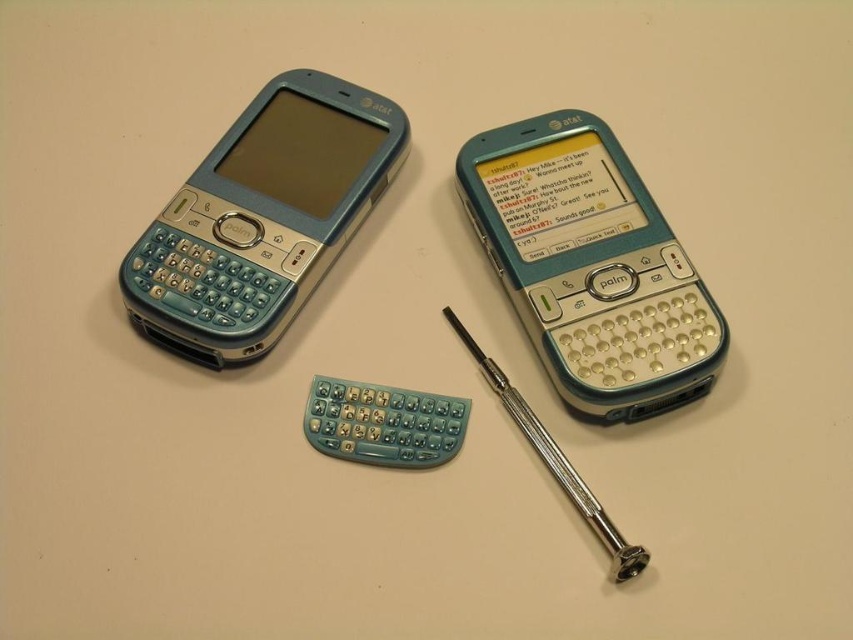
You have a small teal plastic smartphone at center and a teal plastic keyboard at left. You want to place both on a shelf that can only accommodate items up to 10 cm in width. Given their widths, which item will fit better on the shelf?

The teal plastic smartphone at center has a smaller width than the teal plastic keyboard at left, so it will fit better on the shelf that can only accommodate items up to 10 cm in width.

Where is the teal plastic smartphone at center located in the image?

The teal plastic smartphone at center is located at point coordinates of (590, 266).